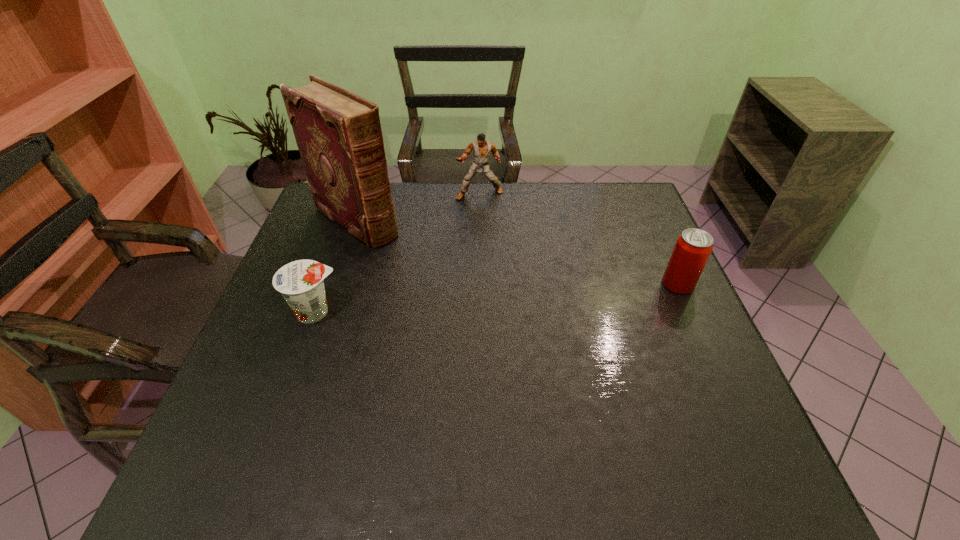
The height and width of the screenshot is (540, 960). I want to click on vacant area that lies between the hardback book and the third tallest object, so click(517, 253).

Find the location of a particular element. free space between the yogurt and the can is located at coordinates (497, 298).

Locate an element on the screen. free space between the rightmost object and the yogurt is located at coordinates (497, 298).

The image size is (960, 540). In order to click on free space between the rightmost object and the tallest object in this screenshot , I will do `click(517, 253)`.

Select which object is the third closest to the third shortest object. Please provide its 2D coordinates. Your answer should be formatted as a tuple, i.e. [(x, y)], where the tuple contains the x and y coordinates of a point satisfying the conditions above.

[(693, 247)]

Identify which object is the nearest to the hardback book. Please provide its 2D coordinates. Your answer should be formatted as a tuple, i.e. [(x, y)], where the tuple contains the x and y coordinates of a point satisfying the conditions above.

[(482, 149)]

Find the location of a particular element. The height and width of the screenshot is (540, 960). vacant region that satisfies the following two spatial constraints: 1. on the back side of the second shortest object; 2. on the right side of the shortest object is located at coordinates pyautogui.click(x=325, y=284).

Where is `free spot that satisfies the following two spatial constraints: 1. on the back side of the hardback book; 2. on the left side of the second tallest object`? The width and height of the screenshot is (960, 540). free spot that satisfies the following two spatial constraints: 1. on the back side of the hardback book; 2. on the left side of the second tallest object is located at coordinates (365, 194).

Image resolution: width=960 pixels, height=540 pixels. Identify the location of vacant space that satisfies the following two spatial constraints: 1. on the front side of the hardback book; 2. on the left side of the third tallest object. (335, 284).